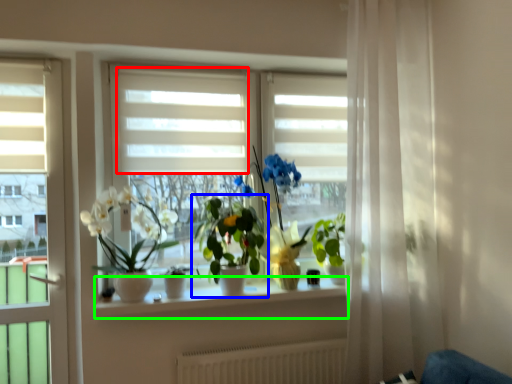
Question: Based on their relative distances, which object is nearer to blind (highlighted by a red box)? Choose from houseplant (highlighted by a blue box) and window sill (highlighted by a green box).

Choices:
 (A) houseplant
 (B) window sill

Answer: (A)